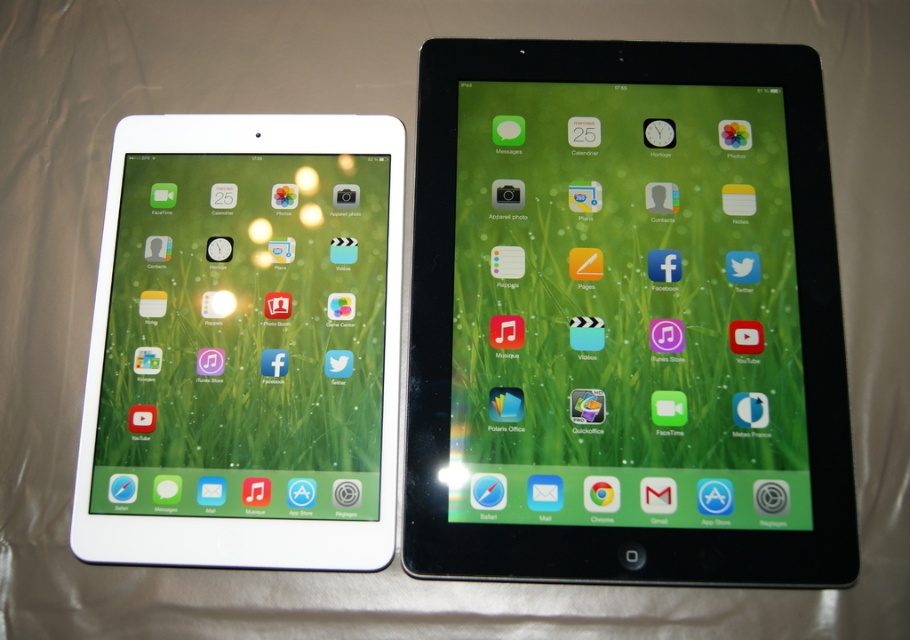
You are an interior designer trying to place a 7.5 inch wide decorative item between the black glossy tablet at upper right and the white glossy tablet at left. Based on the spacing between them, will the item fit without overlapping either device?

The distance between the black glossy tablet at upper right and the white glossy tablet at left is 6.81 inches. Since the decorative item is 7.5 inches wide, it is wider than the available space. Therefore, the item will not fit without overlapping one or both devices.

Consider the image. You are setting up a display for a tech event and need to arrange two tablets. You have a black glossy tablet at upper right and a white glossy tablet at left. According to the image, which tablet should you place on the right side of the display?

The black glossy tablet at upper right should be placed on the right side of the display because it is already positioned to the right of the white glossy tablet at left in the image.

Based on the photo, you are standing in front of two tablets displayed side by side. You want to locate the black glossy tablet at upper right. Where should you look relative to the other tablet?

The black glossy tablet at upper right is located at point (x=625, y=317), so you should look towards the upper right position relative to the other tablet.